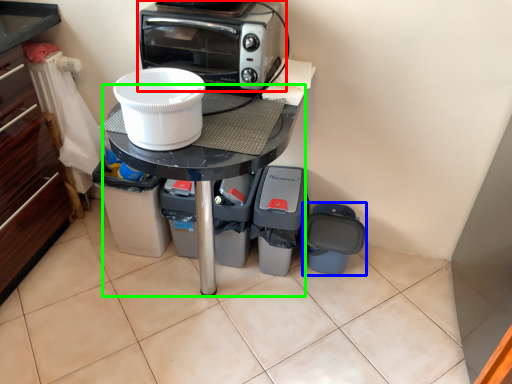
Question: Estimate the real-world distances between objects in this image. Which object is closer to kitchen appliance (highlighted by a red box), appliance (highlighted by a blue box) or table (highlighted by a green box)?

Choices:
 (A) appliance
 (B) table

Answer: (B)